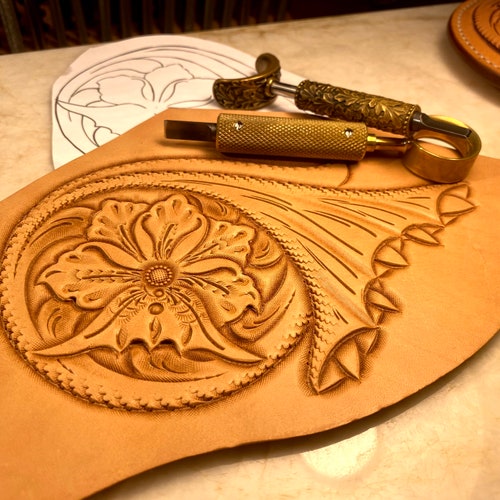
Locate an element on the screen. reflection on table is located at coordinates (336, 457).